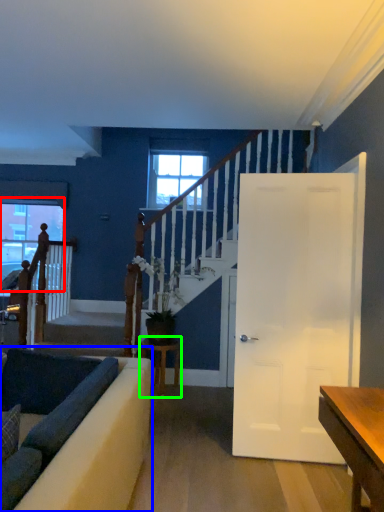
Question: Considering the real-world distances, which object is farthest from window (highlighted by a red box)? studio couch (highlighted by a blue box) or table (highlighted by a green box)?

Choices:
 (A) studio couch
 (B) table

Answer: (A)